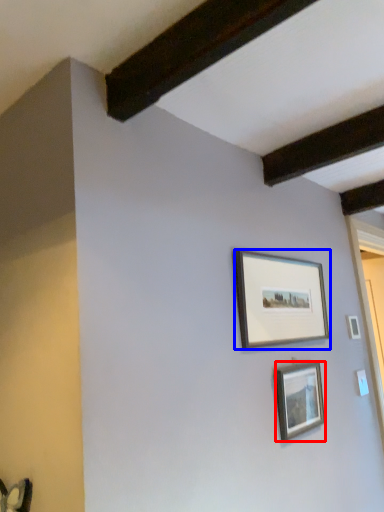
Question: Among these objects, which one is farthest to the camera, picture frame (highlighted by a red box) or picture frame (highlighted by a blue box)?

Choices:
 (A) picture frame
 (B) picture frame

Answer: (A)